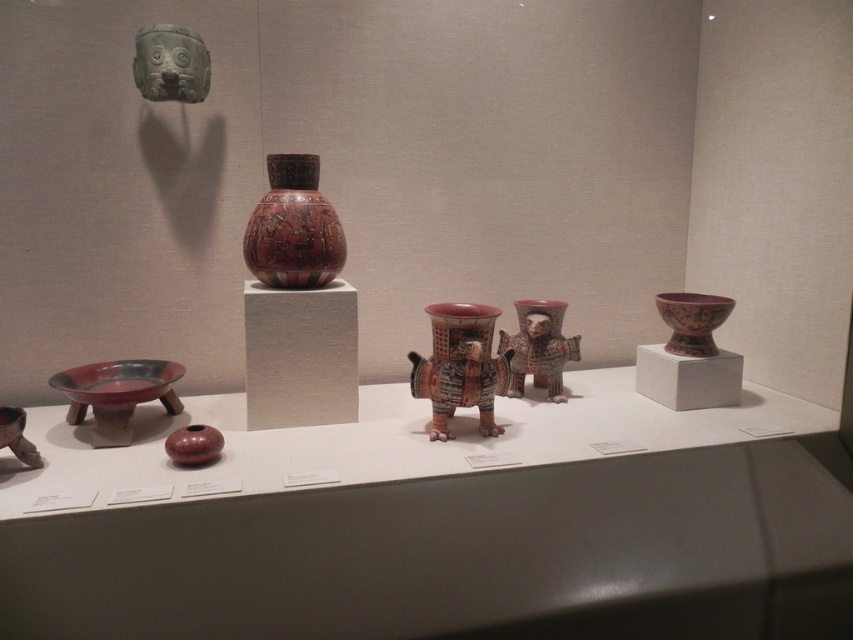
You are a museum visitor standing in front of the exhibit shelf. You want to take a photo of the polychrome ceramic vessel at center and the matte red bowl at center right. To ensure both are in frame, should you position yourself to the left or right of the exhibit shelf?

You should position yourself to the right of the exhibit shelf. Since the polychrome ceramic vessel at center is to the left of the matte red bowl at center right, positioning yourself to the right allows both items to be captured within the camera frame.

You are a museum curator planning to move the polychrome ceramic vessel at center and the matte red bowl at center right to a new exhibit. The new shelf has limited space, and you need to know which object is wider to ensure proper placement. Which object has a greater width?

The polychrome ceramic vessel at center has a greater width than the matte red bowl at center right, as stated in the description that its width surpasses the bowl.

You are a museum curator planning to rearrange the display. You need to place a new item that requires more space than the current items. Which object between the matte clay vase at center and the polychrome ceramic figure at center should you consider removing to accommodate the larger item?

The matte clay vase at center occupies less space than the polychrome ceramic figure at center, so removing the matte clay vase at center would free up more space for the new item.